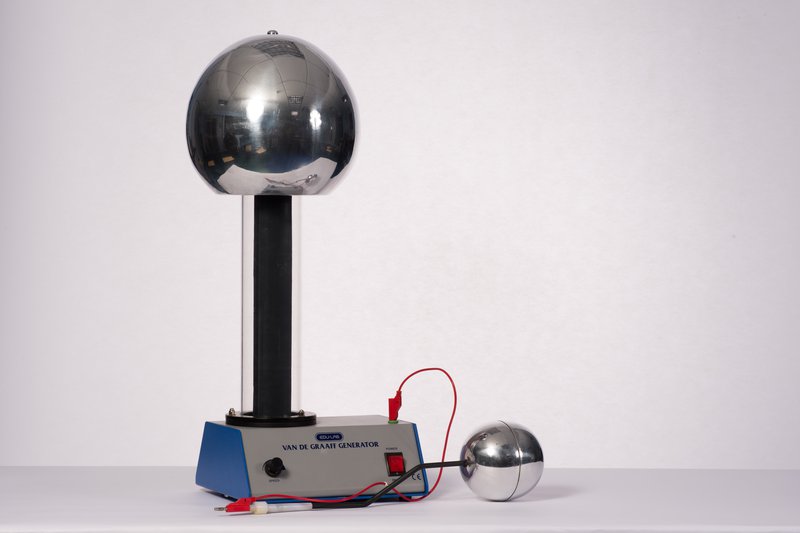
You are a GUI agent. You are given a task and a screenshot of the screen. Output one action in this format:
    pyautogui.click(x=<x>, y=<y>)
    Task: Click on the power switch
    Image resolution: width=800 pixels, height=533 pixels.
    Given the screenshot: What is the action you would take?
    pyautogui.click(x=396, y=464)